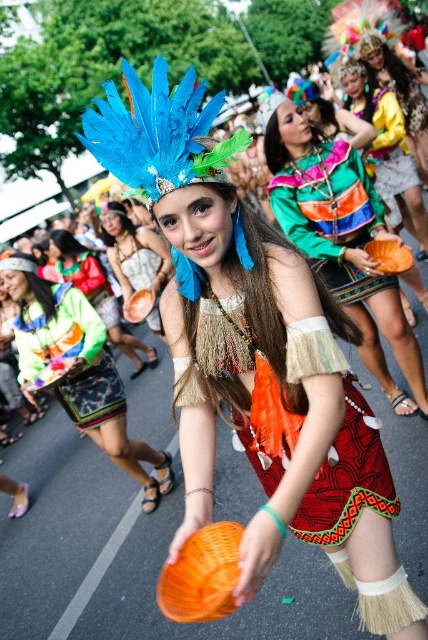
Can you confirm if matte blue feather headdress at upper center is shorter than shiny metallic vest at center?

In fact, matte blue feather headdress at upper center may be taller than shiny metallic vest at center.

Who is more forward, (62, 230) or (354, 108)?

Point (354, 108) is more forward.

Where is `matte blue feather headdress at upper center`? This screenshot has width=428, height=640. matte blue feather headdress at upper center is located at coordinates (98, 294).

Who is higher up, matte orange bowl at center or matte blue feather headdress at upper center?

matte blue feather headdress at upper center is above.

Is matte orange bowl at center above matte blue feather headdress at upper center?

No, matte orange bowl at center is not above matte blue feather headdress at upper center.

The height and width of the screenshot is (640, 428). Find the location of `matte orange bowl at center`. matte orange bowl at center is located at coordinates (79, 369).

From the picture: Can you confirm if shiny orange pumpkin at center is shorter than multicolored woven fabric skirt at lower left?

No, shiny orange pumpkin at center is not shorter than multicolored woven fabric skirt at lower left.

Is point (377, 276) farther from camera compared to point (23, 348)?

No.

Measure the distance between shiny orange pumpkin at center and camera.

shiny orange pumpkin at center is 6.28 feet from camera.

I want to click on shiny orange pumpkin at center, so click(341, 237).